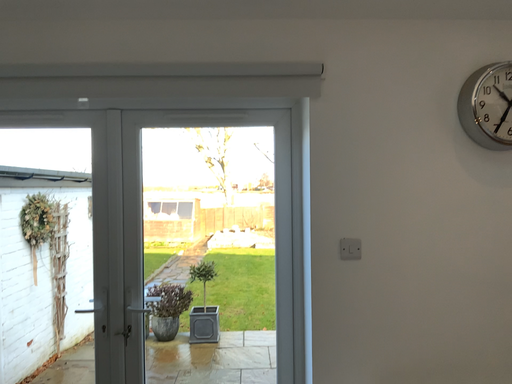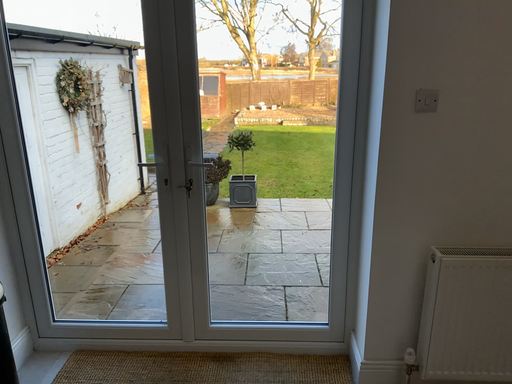
Question: Which way did the camera rotate in the video?

Choices:
 (A) rotated downward
 (B) rotated upward

Answer: (A)